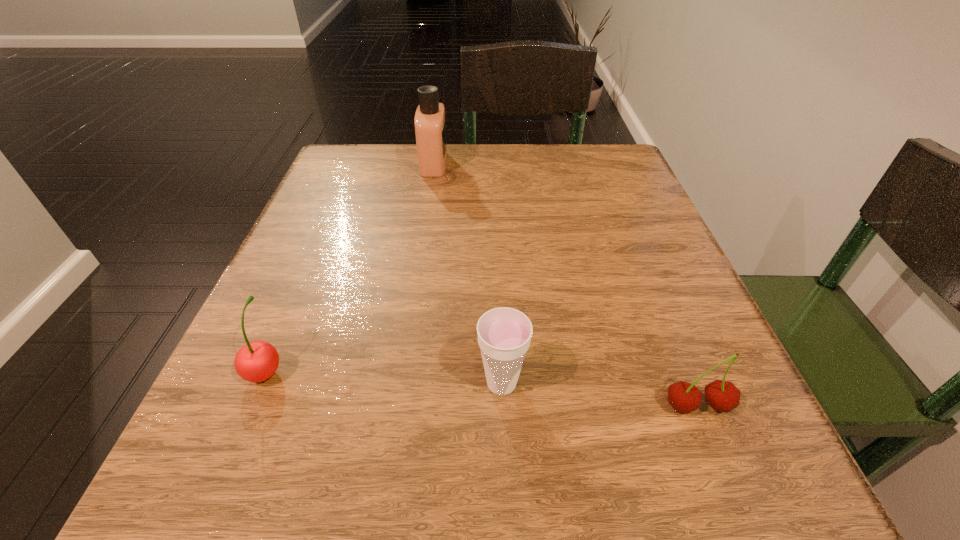
Locate an element on the screen. the farthest object is located at coordinates (430, 122).

I want to click on the second object from left to right, so click(x=430, y=122).

This screenshot has height=540, width=960. Find the location of `the second object from right to left`. the second object from right to left is located at coordinates (504, 334).

I want to click on the left cherry, so click(257, 361).

Where is `the farther cherry`? This screenshot has height=540, width=960. the farther cherry is located at coordinates (257, 361).

I want to click on the right cherry, so click(x=724, y=396).

The width and height of the screenshot is (960, 540). Find the location of `the nearer cherry`. the nearer cherry is located at coordinates (724, 396).

This screenshot has width=960, height=540. I want to click on free region located on the front label of the second object from left to right, so click(x=517, y=164).

Identify the location of free space located on the back of the cup. (499, 335).

At what (x,y) coordinates should I click in order to perform the action: click on free space located on the right of the farther cherry. Please return your answer as a coordinate pair (x, y). This screenshot has width=960, height=540. Looking at the image, I should click on (510, 370).